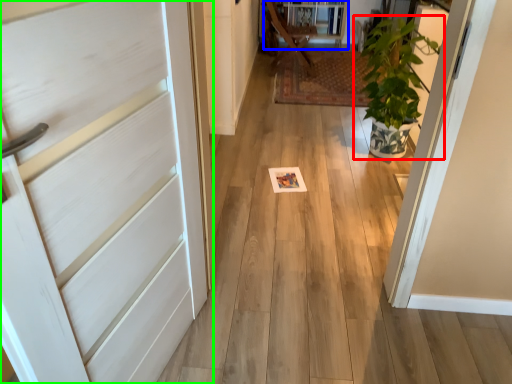
Question: Which is farther away from houseplant (highlighted by a red box)? bookshelf (highlighted by a blue box) or door (highlighted by a green box)?

Choices:
 (A) bookshelf
 (B) door

Answer: (B)